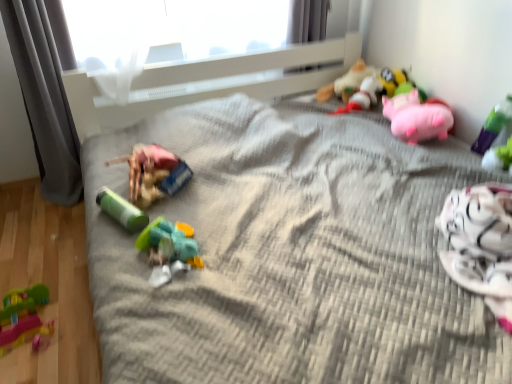
Question: From the image's perspective, does pink plush pig at upper right, placed as the 5th toy when sorted from left to right, appear lower than green plastic toy at upper right, marked as the 7th toy in a left-to-right arrangement?

Choices:
 (A) yes
 (B) no

Answer: (B)

Question: Is pink plush pig at upper right, placed as the 5th toy when sorted from left to right, at the left side of green plastic toy at upper right, marked as the 7th toy in a left-to-right arrangement?

Choices:
 (A) no
 (B) yes

Answer: (B)

Question: From a real-world perspective, is pink plush pig at upper right, placed as the 5th toy when sorted from left to right, beneath green plastic toy at upper right, arranged as the 1th toy when viewed from the right?

Choices:
 (A) yes
 (B) no

Answer: (A)

Question: Does pink plush pig at upper right, which is the third toy in right-to-left order, have a larger size compared to green plastic toy at upper right, arranged as the 1th toy when viewed from the right?

Choices:
 (A) no
 (B) yes

Answer: (B)

Question: Is pink plush pig at upper right, placed as the 5th toy when sorted from left to right, wider than green plastic toy at upper right, marked as the 7th toy in a left-to-right arrangement?

Choices:
 (A) yes
 (B) no

Answer: (A)

Question: Is point (357, 69) positioned closer to the camera than point (35, 331)?

Choices:
 (A) closer
 (B) farther

Answer: (B)

Question: In terms of width, does soft plush toy at upper right, which ranks as the 4th toy in left-to-right order, look wider or thinner when compared to rubberized green and pink toy at lower left, which appears as the 7th toy when viewed from the right?

Choices:
 (A) thin
 (B) wide

Answer: (B)

Question: Considering the relative positions of soft plush toy at upper right, which ranks as the 4th toy in left-to-right order, and rubberized green and pink toy at lower left, the 1th toy when ordered from left to right, in the image provided, is soft plush toy at upper right, which ranks as the 4th toy in left-to-right order, to the left or to the right of rubberized green and pink toy at lower left, the 1th toy when ordered from left to right,?

Choices:
 (A) left
 (B) right

Answer: (B)

Question: From a real-world perspective, is soft plush toy at upper right, which ranks as the 4th toy in left-to-right order, physically located above or below rubberized green and pink toy at lower left, which appears as the 7th toy when viewed from the right?

Choices:
 (A) above
 (B) below

Answer: (A)

Question: Is gray fabric curtain at left, which is the first curtain in left-to-right order, inside or outside of rubber duck at center, acting as the third toy starting from the left?

Choices:
 (A) inside
 (B) outside

Answer: (B)

Question: From their relative heights in the image, would you say gray fabric curtain at left, which is the first curtain in left-to-right order, is taller or shorter than rubber duck at center, the fifth toy viewed from the right?

Choices:
 (A) short
 (B) tall

Answer: (B)

Question: Considering the positions of gray fabric curtain at left, which appears as the 2th curtain when viewed from the right, and rubber duck at center, acting as the third toy starting from the left, in the image, is gray fabric curtain at left, which appears as the 2th curtain when viewed from the right, wider or thinner than rubber duck at center, acting as the third toy starting from the left,?

Choices:
 (A) thin
 (B) wide

Answer: (A)

Question: In terms of size, does gray fabric curtain at left, which appears as the 2th curtain when viewed from the right, appear bigger or smaller than rubber duck at center, acting as the third toy starting from the left?

Choices:
 (A) big
 (B) small

Answer: (A)

Question: In terms of height, does green plastic toy at upper right, marked as the 7th toy in a left-to-right arrangement, look taller or shorter compared to pink plush pig at upper right, which is the third toy in right-to-left order?

Choices:
 (A) tall
 (B) short

Answer: (A)

Question: Considering the relative positions of green plastic toy at upper right, marked as the 7th toy in a left-to-right arrangement, and pink plush pig at upper right, which is the third toy in right-to-left order, in the image provided, is green plastic toy at upper right, marked as the 7th toy in a left-to-right arrangement, to the left or to the right of pink plush pig at upper right, which is the third toy in right-to-left order,?

Choices:
 (A) right
 (B) left

Answer: (A)